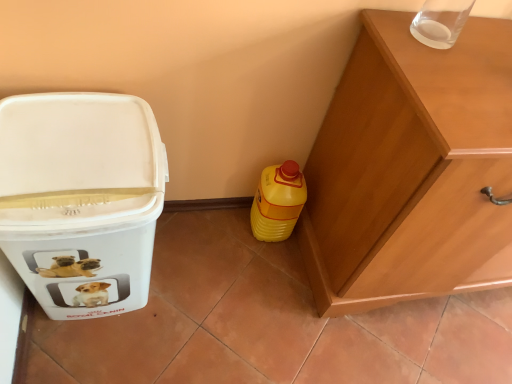
Identify the location of free region on the left part of yellow plastic bottle at lower right. This screenshot has height=384, width=512. (215, 224).